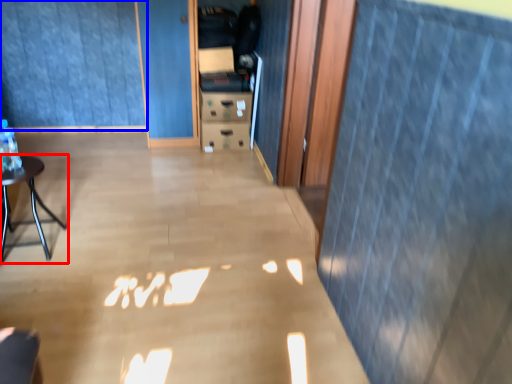
Question: Which point is closer to the camera, furniture (highlighted by a red box) or curtain (highlighted by a blue box)?

Choices:
 (A) furniture
 (B) curtain

Answer: (A)